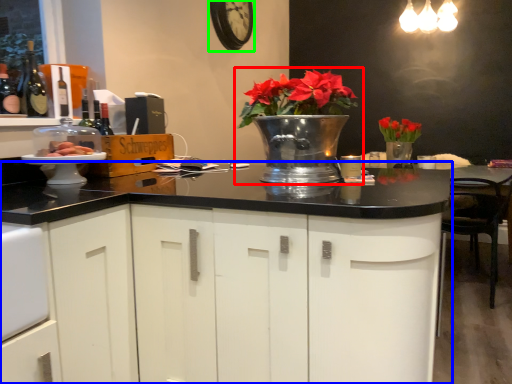
Question: Based on their relative distances, which object is nearer to houseplant (highlighted by a red box)? Choose from cabinetry (highlighted by a blue box) and clock (highlighted by a green box).

Choices:
 (A) cabinetry
 (B) clock

Answer: (A)